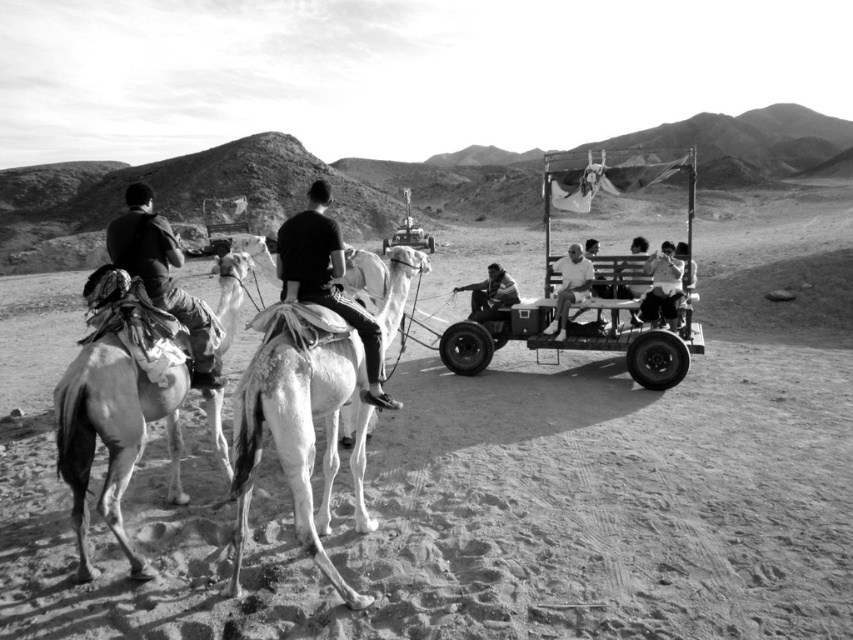
You are a photographer standing in the desert scene. You want to take a photo that includes both the metallic cart at center and the light brown textured camel at left. Based on their positions, will the camel be visible in the photo if the cart is in focus?

The metallic cart at center is above the light brown textured camel at left. Since the cart is positioned above the camel, if the cart is in focus, the camel might be partially or fully obscured depending on the camera angle and zoom. However, based on their spatial arrangement, the camel could still be visible below the cart in the photo.

You are a photographer standing in the desert scene. You notice two jackets in the image. The first is a dark fabric jacket at left, and the second is a smooth leather jacket at center. Which jacket appears closer to you?

The dark fabric jacket at left appears closer to you because it is positioned closer to the viewer than the smooth leather jacket at center.